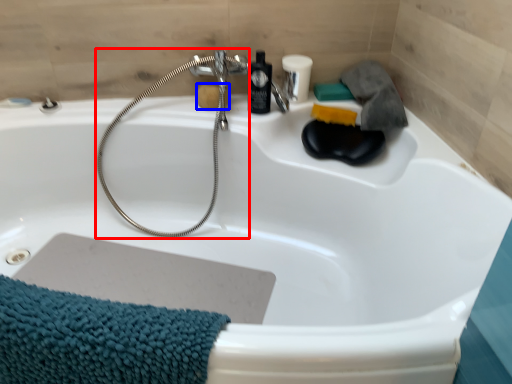
Question: Which object is further to the camera taking this photo, garden hose (highlighted by a red box) or soap (highlighted by a blue box)?

Choices:
 (A) garden hose
 (B) soap

Answer: (B)